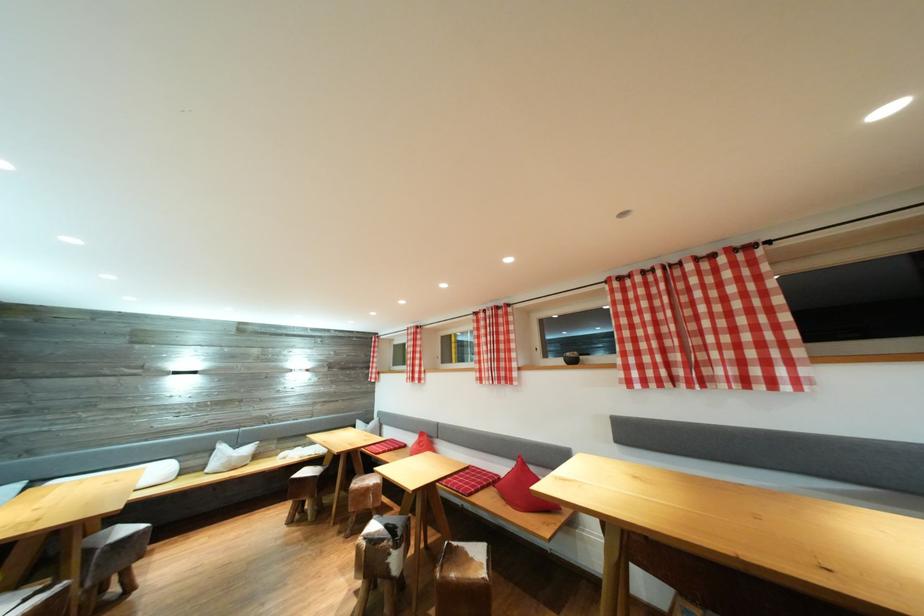
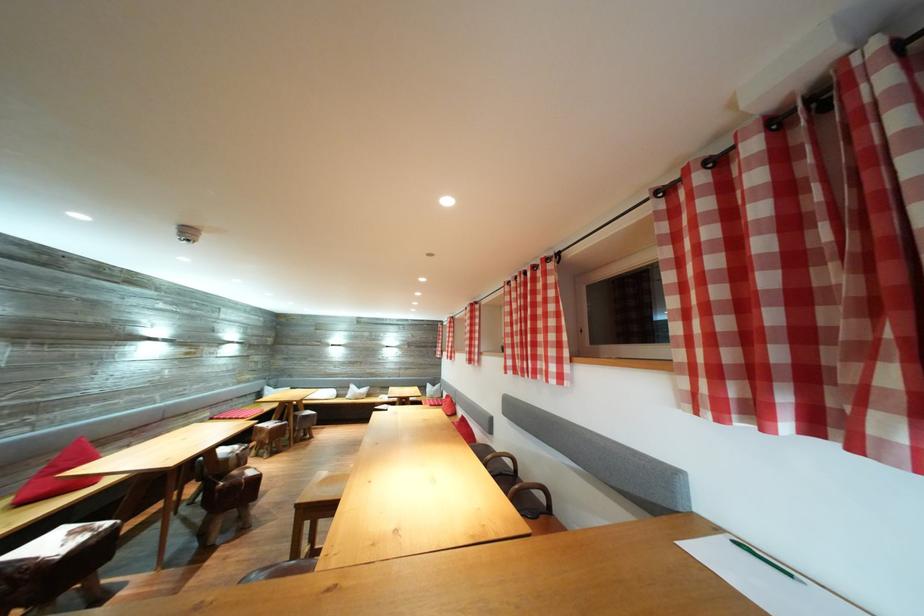
Locate, in the second image, the point that corresponds to (641,379) in the first image.

(517, 368)